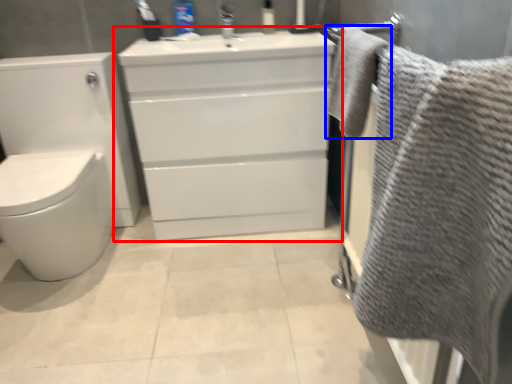
Question: Among these objects, which one is farthest to the camera, bathroom cabinet (highlighted by a red box) or bath towel (highlighted by a blue box)?

Choices:
 (A) bathroom cabinet
 (B) bath towel

Answer: (A)